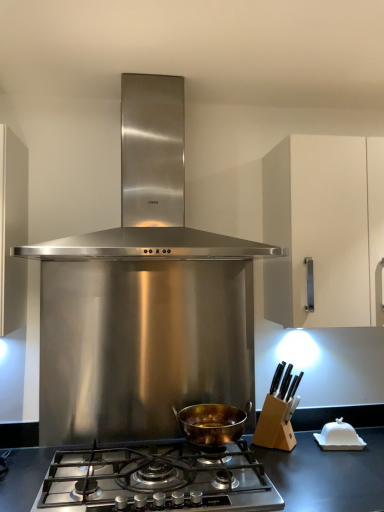
Question: From a real-world perspective, relative to white matte cabinet at right, is gold-bronze pot at center, which ranks as the 1th kitchen appliance in bottom-to-top order, vertically above or below?

Choices:
 (A) below
 (B) above

Answer: (A)

Question: In the image, is gold-bronze pot at center, which ranks as the second kitchen appliance in top-to-bottom order, on the left side or the right side of white matte cabinet at right?

Choices:
 (A) right
 (B) left

Answer: (B)

Question: Which object is the closest to the stainless steel range hood at center, which is counted as the 2th kitchen appliance, starting from the bottom?

Choices:
 (A) gold-bronze pot at center, which ranks as the 1th kitchen appliance in bottom-to-top order
 (B) stainless steel gas stove at center
 (C) white matte cabinet at right

Answer: (C)

Question: Which is nearer to the stainless steel range hood at center, which is counted as the 2th kitchen appliance, starting from the bottom?

Choices:
 (A) white matte cabinet at right
 (B) stainless steel gas stove at center
 (C) gold-bronze pot at center, which ranks as the second kitchen appliance in top-to-bottom order

Answer: (A)